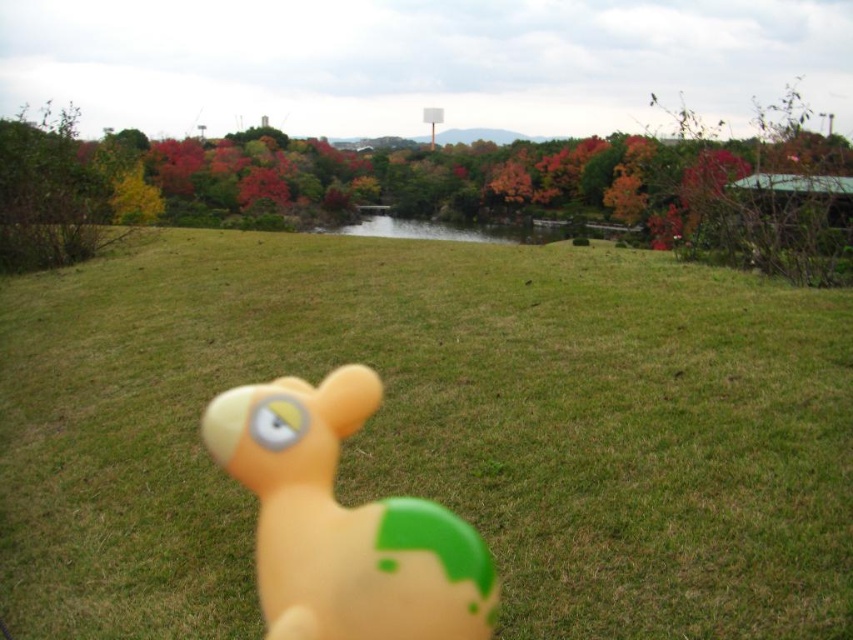
Question: Is green grass at center in front of green leafy bush at left?

Choices:
 (A) no
 (B) yes

Answer: (B)

Question: Is green grass at center positioned in front of rubber duck at center?

Choices:
 (A) no
 (B) yes

Answer: (B)

Question: Which point appears farthest from the camera in this image?

Choices:
 (A) (252, 586)
 (B) (421, 573)
 (C) (15, 227)

Answer: (C)

Question: Which point is farther from the camera taking this photo?

Choices:
 (A) (537, 387)
 (B) (328, 436)

Answer: (A)

Question: Can you confirm if green grass at center is smaller than green leafy bush at left?

Choices:
 (A) no
 (B) yes

Answer: (B)

Question: Which object is positioned closest to the rubber duck at center?

Choices:
 (A) green leafy bush at left
 (B) green grass at center

Answer: (B)